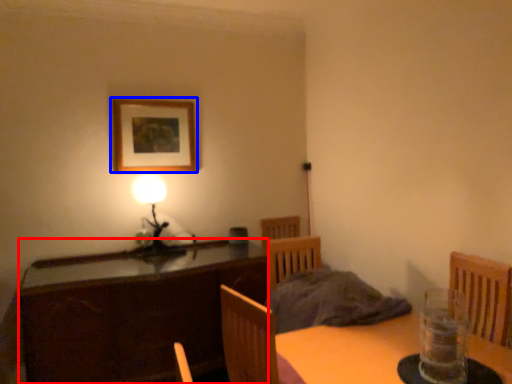
Question: Which of the following is the closest to the observer, cabinetry (highlighted by a red box) or picture frame (highlighted by a blue box)?

Choices:
 (A) cabinetry
 (B) picture frame

Answer: (A)